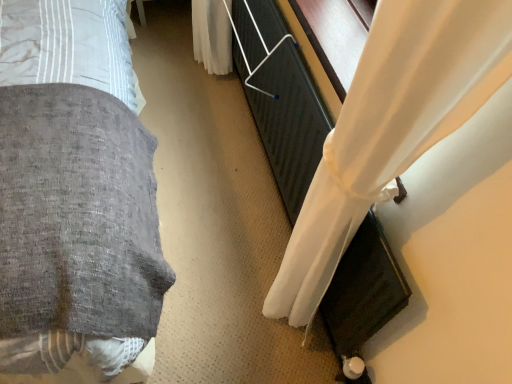
Question: Based on their positions, is textured gray blanket at left located to the left or right of white sheer curtain at right?

Choices:
 (A) left
 (B) right

Answer: (A)

Question: Considering the positions of point (73, 59) and point (332, 269), is point (73, 59) closer or farther from the camera than point (332, 269)?

Choices:
 (A) closer
 (B) farther

Answer: (B)

Question: From their relative heights in the image, would you say textured gray blanket at left is taller or shorter than white sheer curtain at right?

Choices:
 (A) tall
 (B) short

Answer: (A)

Question: Considering the positions of white sheer curtain at right and textured gray blanket at left in the image, is white sheer curtain at right bigger or smaller than textured gray blanket at left?

Choices:
 (A) big
 (B) small

Answer: (B)

Question: Is point (394, 87) closer or farther from the camera than point (118, 46)?

Choices:
 (A) farther
 (B) closer

Answer: (B)

Question: Is white sheer curtain at right inside or outside of textured gray blanket at left?

Choices:
 (A) outside
 (B) inside

Answer: (A)

Question: Is white sheer curtain at right taller or shorter than textured gray blanket at left?

Choices:
 (A) short
 (B) tall

Answer: (A)